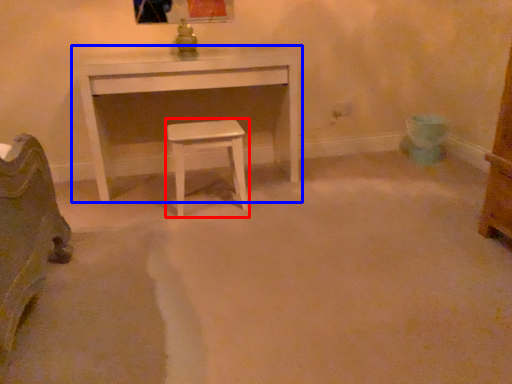
Question: Which object is closer to the camera taking this photo, stool (highlighted by a red box) or table (highlighted by a blue box)?

Choices:
 (A) stool
 (B) table

Answer: (A)